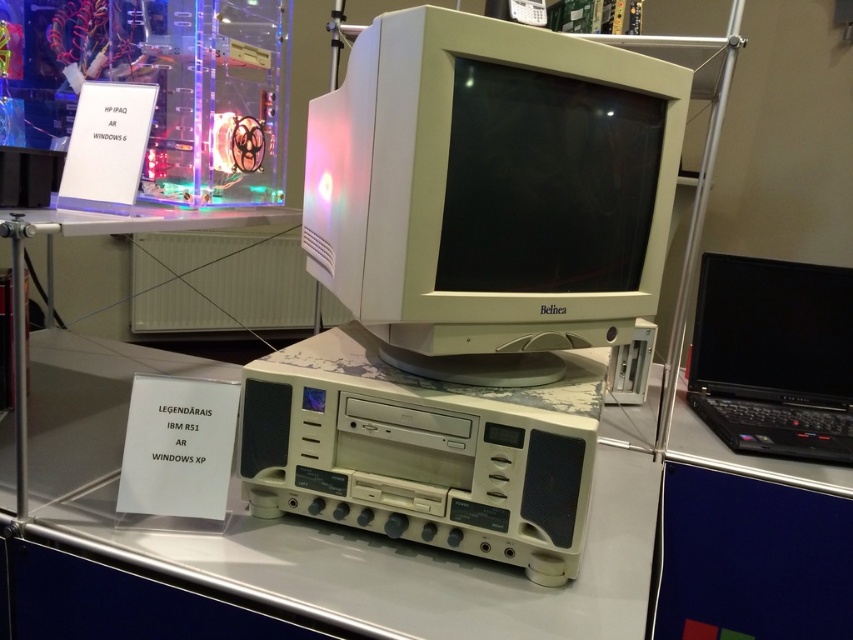
Question: Which object is farther from the camera taking this photo?

Choices:
 (A) black plastic laptop at right
 (B) white plastic table at center

Answer: (A)

Question: Can you confirm if white plastic table at center is positioned above black plastic laptop at right?

Choices:
 (A) no
 (B) yes

Answer: (B)

Question: Among these points, which one is farthest from the camera?

Choices:
 (A) (90, 545)
 (B) (700, 394)
 (C) (322, 138)

Answer: (B)

Question: Considering the real-world distances, which object is farthest from the black plastic laptop at right?

Choices:
 (A) white plastic table at center
 (B) white plastic monitor at center

Answer: (B)

Question: Does white plastic table at center appear on the left side of black plastic laptop at right?

Choices:
 (A) no
 (B) yes

Answer: (B)

Question: Observing the image, what is the correct spatial positioning of white plastic monitor at center in reference to white plastic table at center?

Choices:
 (A) left
 (B) right

Answer: (B)